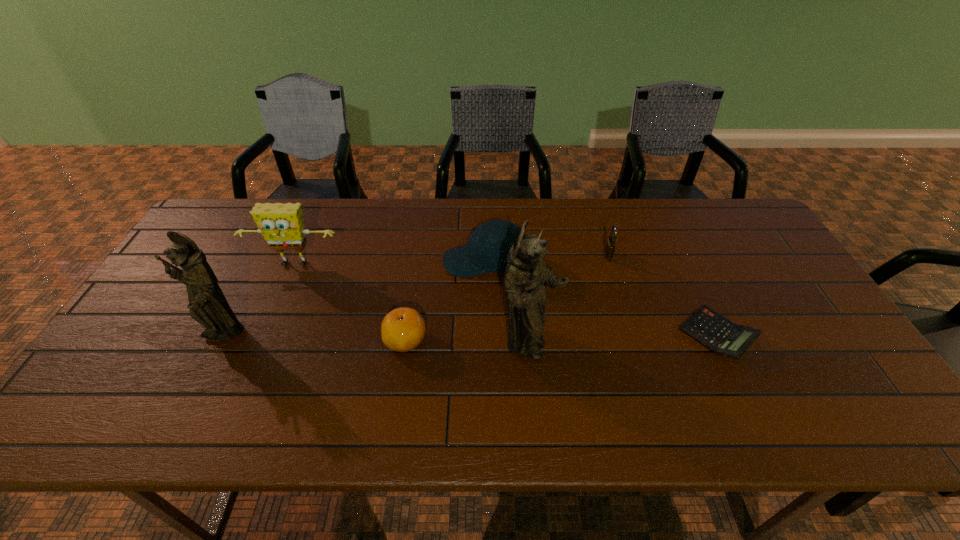
Locate an element on the screen. vacant area that lies between the left figurine and the right figurine is located at coordinates (376, 340).

At what (x,y) coordinates should I click in order to perform the action: click on vacant space in between the sixth object from left to right and the right figurine. Please return your answer as a coordinate pair (x, y). The height and width of the screenshot is (540, 960). Looking at the image, I should click on (569, 300).

What are the coordinates of `free space that is in between the fifth tallest object and the taller figurine` in the screenshot? It's located at (569, 300).

At what (x,y) coordinates should I click in order to perform the action: click on free space between the tallest object and the third object from left to right. Please return your answer as a coordinate pair (x, y). Image resolution: width=960 pixels, height=540 pixels. Looking at the image, I should click on (468, 342).

The height and width of the screenshot is (540, 960). In order to click on unoccupied area between the tallest object and the fifth object from right to left in this screenshot , I will do `click(468, 342)`.

At what (x,y) coordinates should I click in order to perform the action: click on free space between the sponge and the shortest object. Please return your answer as a coordinate pair (x, y). Image resolution: width=960 pixels, height=540 pixels. Looking at the image, I should click on tap(506, 300).

At what (x,y) coordinates should I click in order to perform the action: click on unoccupied area between the baseball cap and the third tallest object. Please return your answer as a coordinate pair (x, y). Looking at the image, I should click on (390, 264).

Where is `unoccupied area between the third object from left to right and the taller figurine`? Image resolution: width=960 pixels, height=540 pixels. unoccupied area between the third object from left to right and the taller figurine is located at coordinates (468, 342).

Identify which object is located as the fifth nearest to the fourth shortest object. Please provide its 2D coordinates. Your answer should be formatted as a tuple, i.e. [(x, y)], where the tuple contains the x and y coordinates of a point satisfying the conditions above.

[(712, 330)]

Choose which object is the second nearest neighbor to the shortest object. Please provide its 2D coordinates. Your answer should be formatted as a tuple, i.e. [(x, y)], where the tuple contains the x and y coordinates of a point satisfying the conditions above.

[(526, 276)]